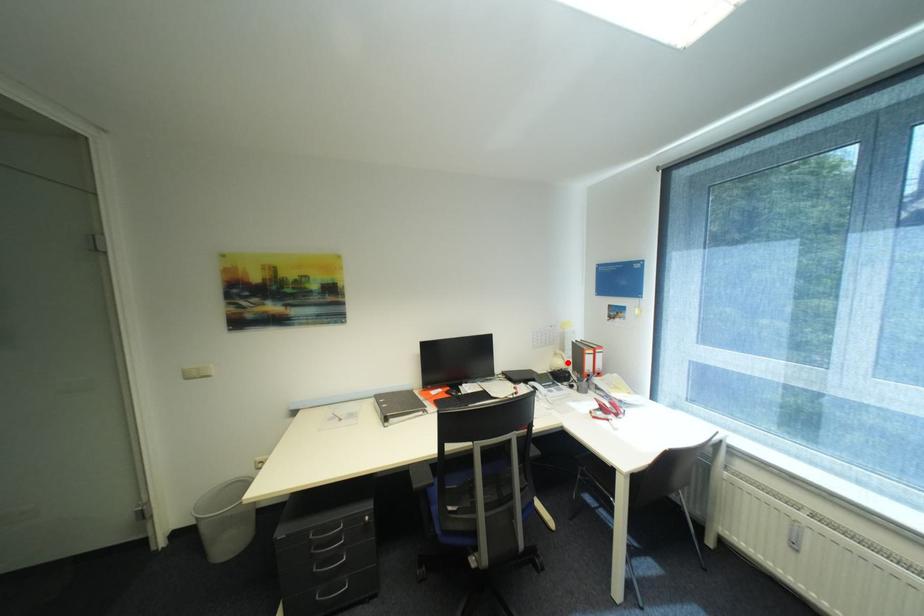
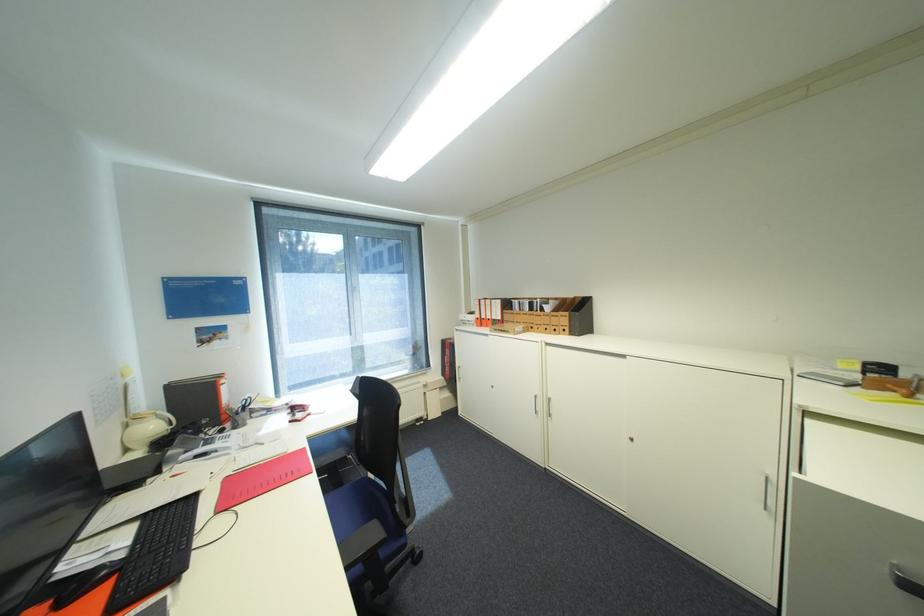
The point at the highlighted location is marked in the first image. Where is the corresponding point in the second image?

(161, 427)